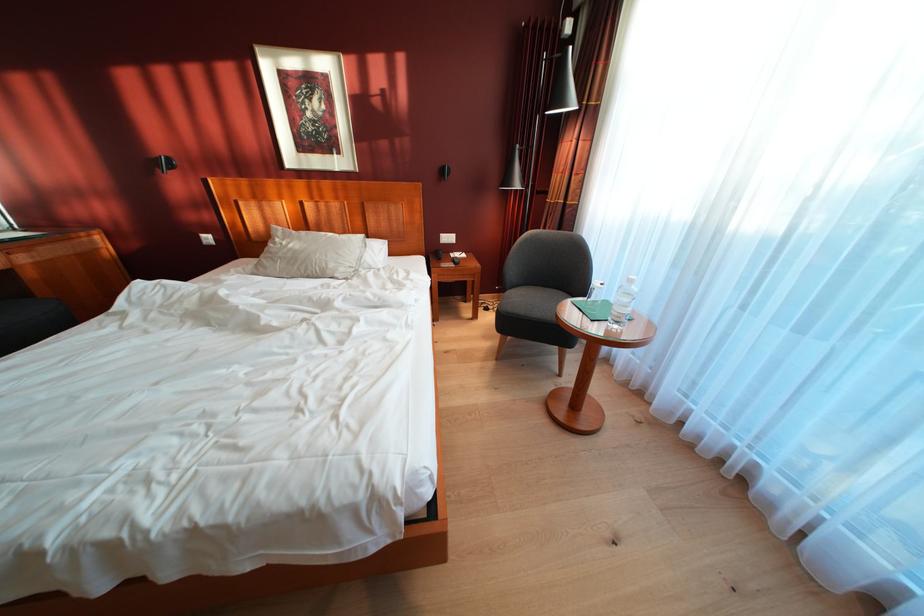
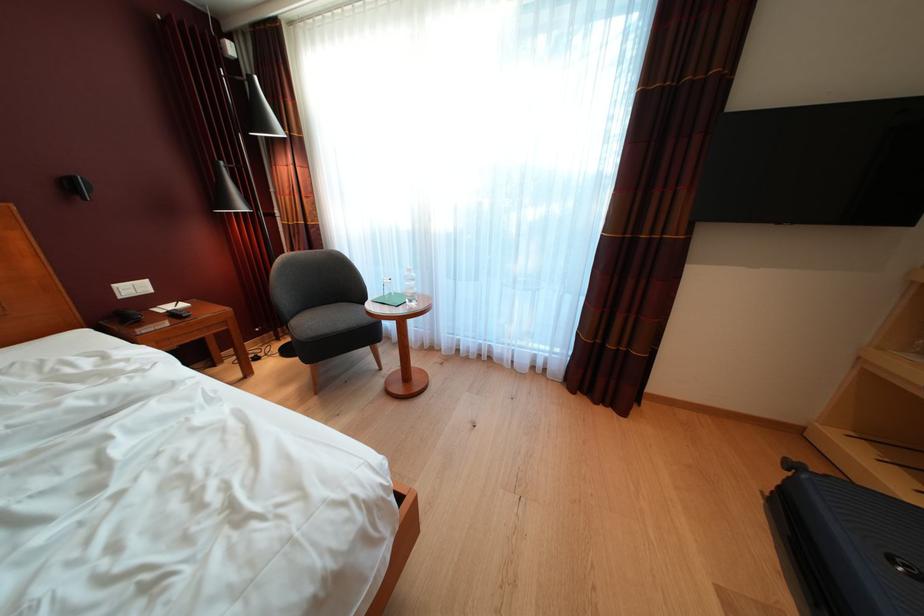
Question: The camera is either moving clockwise (left) or counter-clockwise (right) around the object. The first image is from the beginning of the video and the second image is from the end. Is the camera moving left or right when shooting the video?

Choices:
 (A) Left
 (B) Right

Answer: (A)